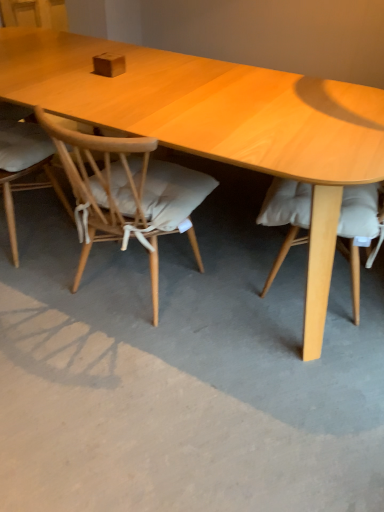
Question: Looking at their shapes, would you say gray concrete at center is wider or thinner than light brown wood chair at left, the first chair viewed from the left?

Choices:
 (A) wide
 (B) thin

Answer: (A)

Question: From a real-world perspective, is gray concrete at center above or below light brown wood chair at left, the first chair viewed from the left?

Choices:
 (A) above
 (B) below

Answer: (B)

Question: Which of these objects is positioned farthest from the light wood chair at center, the second chair viewed from the left?

Choices:
 (A) light brown wood chair at left, the first chair viewed from the left
 (B) gray concrete at center

Answer: (A)

Question: Which object is the farthest from the gray concrete at center?

Choices:
 (A) light brown wood chair at left, which is the second chair in right-to-left order
 (B) light wood chair at center, the 1th chair viewed from the right

Answer: (A)